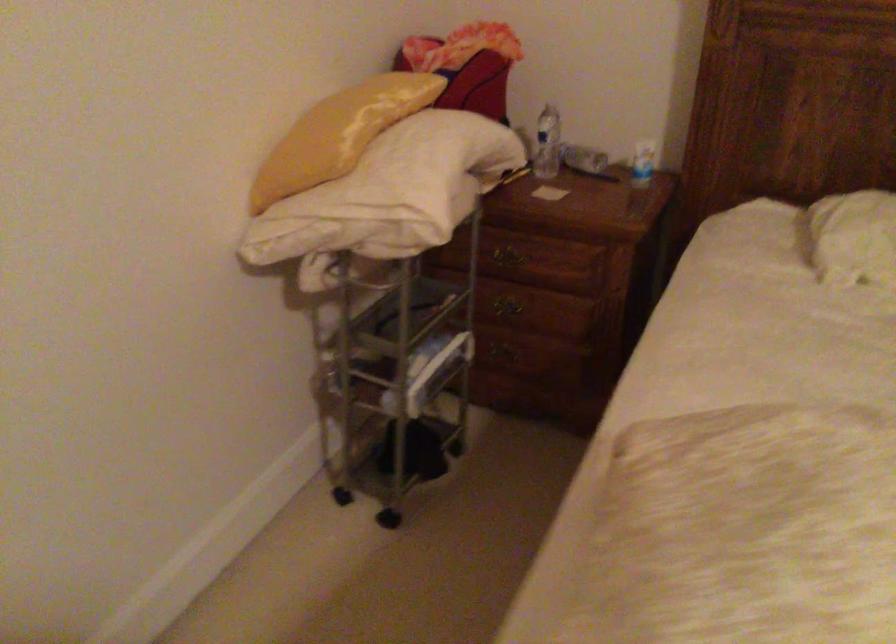
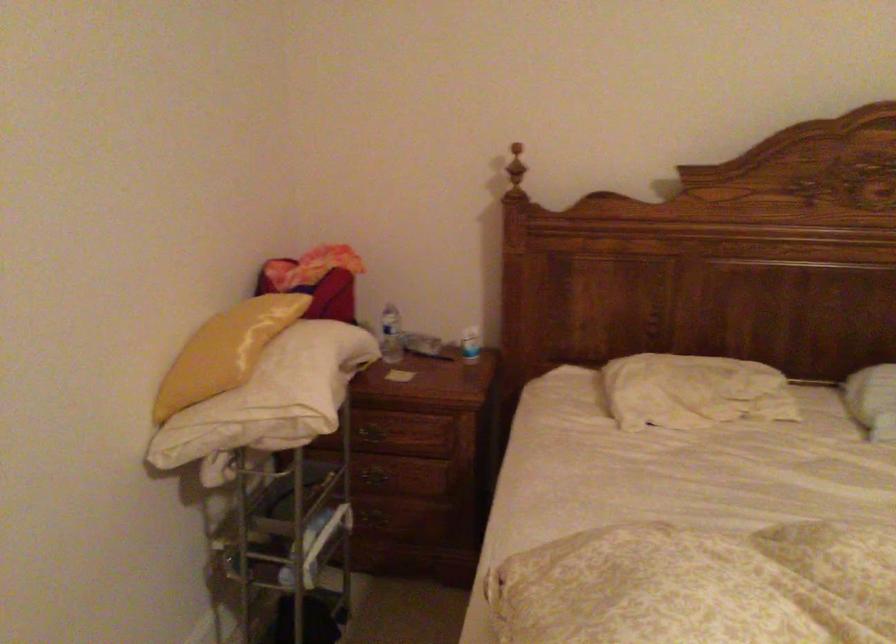
The point at (510, 252) is marked in the first image. Where is the corresponding point in the second image?

(374, 430)